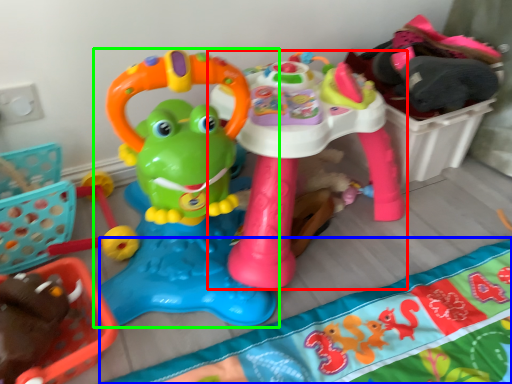
Question: Which is nearer to the toy (highlighted by a red box)? blanket (highlighted by a blue box) or toy (highlighted by a green box).

Choices:
 (A) blanket
 (B) toy

Answer: (B)